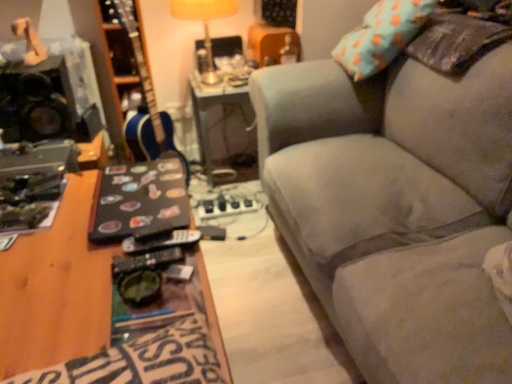
Question: Can you confirm if black matte speaker at left is smaller than metallic silver table at center?

Choices:
 (A) no
 (B) yes

Answer: (B)

Question: From a real-world perspective, is black matte speaker at left on metallic silver table at center?

Choices:
 (A) yes
 (B) no

Answer: (A)

Question: Considering the relative sizes of black matte speaker at left and metallic silver table at center in the image provided, is black matte speaker at left bigger than metallic silver table at center?

Choices:
 (A) yes
 (B) no

Answer: (B)

Question: Considering the relative sizes of black matte speaker at left and metallic silver table at center in the image provided, is black matte speaker at left wider than metallic silver table at center?

Choices:
 (A) no
 (B) yes

Answer: (A)

Question: Considering the relative sizes of black matte speaker at left and metallic silver table at center in the image provided, is black matte speaker at left thinner than metallic silver table at center?

Choices:
 (A) no
 (B) yes

Answer: (B)

Question: Choose the correct answer: Is blue glossy guitar at center inside teal fabric pillow at upper right or outside it?

Choices:
 (A) inside
 (B) outside

Answer: (B)

Question: Is point (154, 137) closer or farther from the camera than point (402, 1)?

Choices:
 (A) closer
 (B) farther

Answer: (B)

Question: From the image's perspective, relative to teal fabric pillow at upper right, is blue glossy guitar at center above or below?

Choices:
 (A) above
 (B) below

Answer: (B)

Question: Would you say blue glossy guitar at center is to the left or to the right of teal fabric pillow at upper right in the picture?

Choices:
 (A) left
 (B) right

Answer: (A)

Question: Does point (368, 52) appear closer or farther from the camera than point (31, 132)?

Choices:
 (A) farther
 (B) closer

Answer: (B)

Question: Based on their sizes in the image, would you say teal fabric pillow at upper right is bigger or smaller than black matte speaker at left?

Choices:
 (A) big
 (B) small

Answer: (A)

Question: Is teal fabric pillow at upper right taller or shorter than black matte speaker at left?

Choices:
 (A) short
 (B) tall

Answer: (B)

Question: Is teal fabric pillow at upper right spatially inside black matte speaker at left, or outside of it?

Choices:
 (A) outside
 (B) inside

Answer: (A)

Question: Would you say metallic silver table at center is to the left or to the right of teal fabric pillow at upper right in the picture?

Choices:
 (A) right
 (B) left

Answer: (B)

Question: Is metallic silver table at center wider or thinner than teal fabric pillow at upper right?

Choices:
 (A) thin
 (B) wide

Answer: (B)